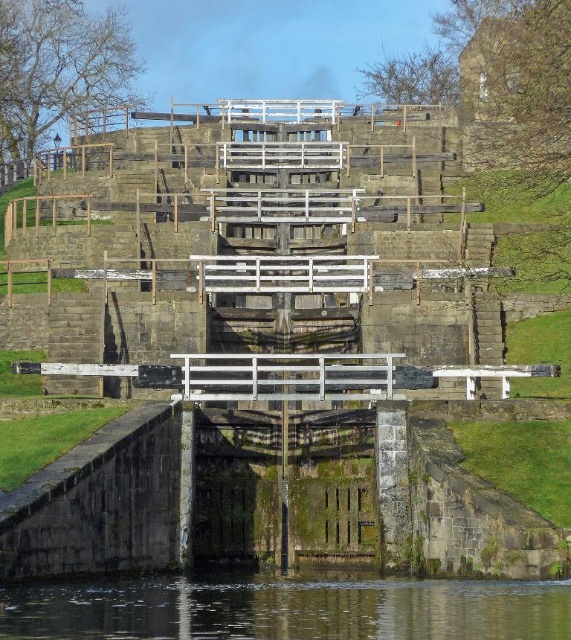
In the scene shown: Is weathered stone stairs at center positioned before clear water at bottom?

No.

Is point (234, 240) less distant than point (85, 586)?

No.

Does point (86, 381) come farther from viewer compared to point (556, 632)?

Yes, point (86, 381) is farther from viewer.

I want to click on weathered stone stairs at center, so click(x=262, y=232).